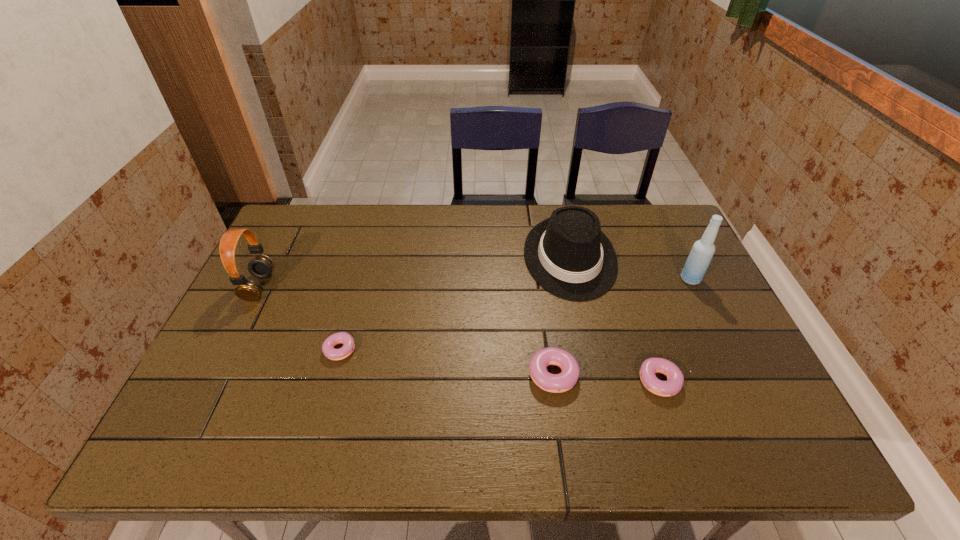
Identify the location of free space that satisfies the following two spatial constraints: 1. on the front-facing side of the bottle; 2. on the left side of the fedora. [575, 279].

Locate an element on the screen. vacant position in the image that satisfies the following two spatial constraints: 1. on the ear cups of the leftmost doughnut; 2. on the right side of the leftmost object is located at coordinates (228, 350).

Find the location of a particular element. Image resolution: width=960 pixels, height=540 pixels. vacant space that satisfies the following two spatial constraints: 1. on the front-facing side of the fourth shortest object; 2. on the ear cups of the leftmost object is located at coordinates (577, 287).

The width and height of the screenshot is (960, 540). Identify the location of vacant area that satisfies the following two spatial constraints: 1. on the front-facing side of the second shortest doughnut; 2. on the right side of the third tallest object. (597, 381).

In order to click on blank area in the image that satisfies the following two spatial constraints: 1. on the front-facing side of the rightmost object; 2. on the left side of the third tallest object in this screenshot , I will do `click(575, 279)`.

What are the coordinates of `free point that satisfies the following two spatial constraints: 1. on the back side of the bottle; 2. on the left side of the second doughnut from right to left` in the screenshot? It's located at (540, 279).

The height and width of the screenshot is (540, 960). What are the coordinates of `free spot that satisfies the following two spatial constraints: 1. on the front side of the second tallest doughnut; 2. on the right side of the second doughnut from right to left` in the screenshot? It's located at (554, 381).

Find the location of `free point that satisfies the following two spatial constraints: 1. on the back side of the fifth tallest object; 2. on the ear cups of the leftmost object`. free point that satisfies the following two spatial constraints: 1. on the back side of the fifth tallest object; 2. on the ear cups of the leftmost object is located at coordinates (632, 287).

The height and width of the screenshot is (540, 960). I want to click on vacant region that satisfies the following two spatial constraints: 1. on the ear cups of the second tallest object; 2. on the left side of the tallest doughnut, so click(x=217, y=370).